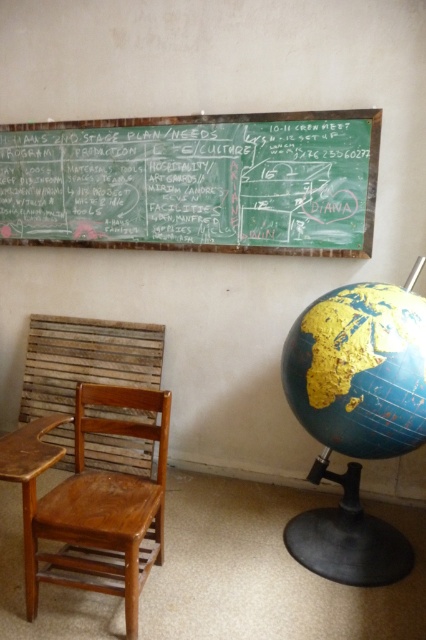
You are standing in front of the green chalkboard mounted on a plain white wall. You need to reach a point located at coordinates point (290, 177) on the chalkboard to write something. Considering your height, which is 5 feet 6 inches, can you comfortably reach that point without needing a stool?

The distance of point (290, 177) from viewer is 8.76 feet. Since the point is 8.76 feet away from you, it is too far to reach comfortably without a stool. You would need a stool to extend your reach.

You are organizing a meeting in this room and need to seat 3 people. The wooden chair at left and the brown wood table at left are available. Can both accommodate three people comfortably?

The wooden chair at left is bigger than the brown wood table at left, but neither the chair nor the table can accommodate three people comfortably on their own. You would need additional seating and table space.

You are an event planner organizing a conference. You need to place a large banner that requires a wide surface. Based on the image, which object between the green chalkboard at upper center and the blue matte globe at lower right would be more suitable for hanging the banner?

The green chalkboard at upper center is wider than the blue matte globe at lower right, so it would be more suitable for hanging the large banner that requires a wide surface.